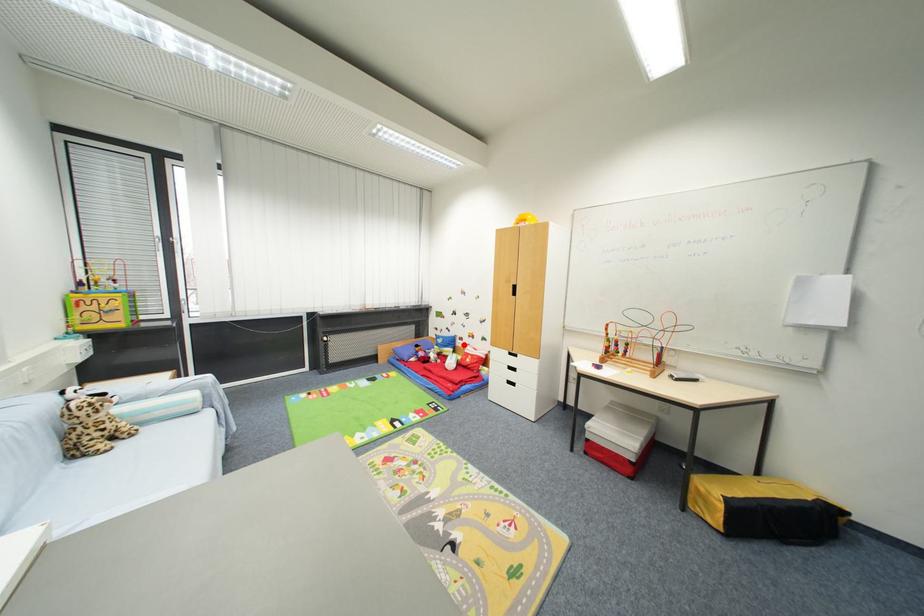
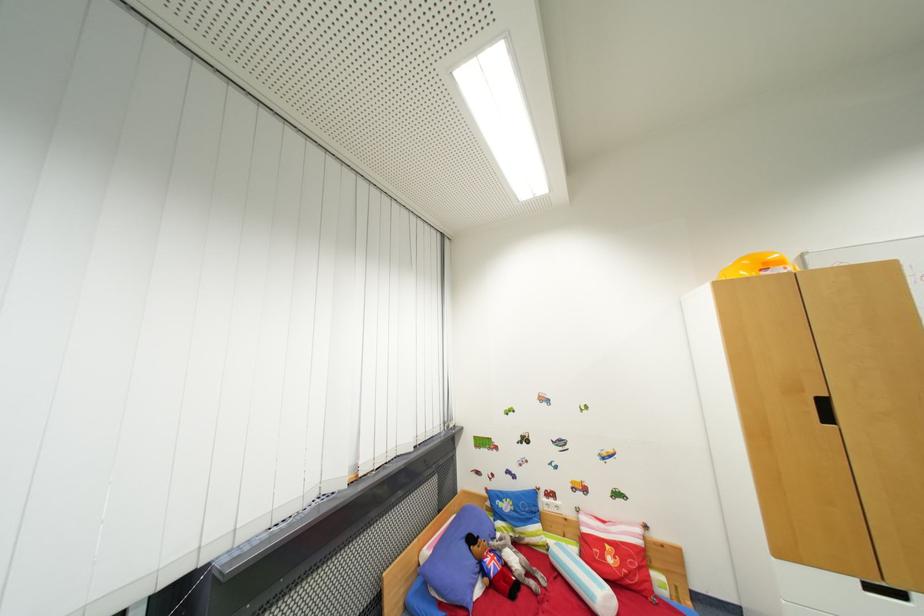
Question: I am providing you with two images of the same scene from different viewpoints. Given a red point in image1, look at the same physical point in image2. Is it:

Choices:
 (A) Closer to the viewpoint
 (B) Farther from the viewpoint

Answer: (A)